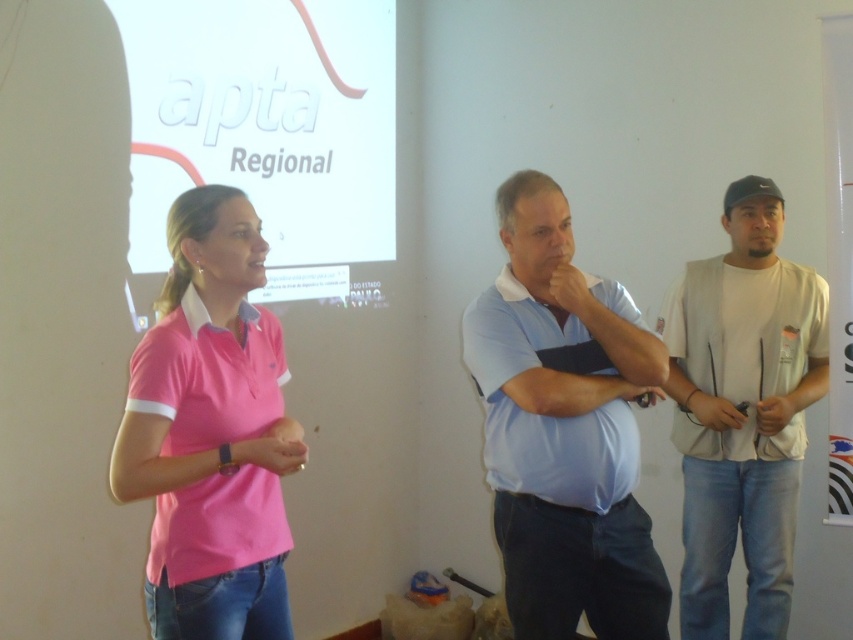
Question: Which of the following is the farthest from the observer?

Choices:
 (A) (578, 392)
 (B) (178, 262)

Answer: (A)

Question: Which point is closer to the camera taking this photo?

Choices:
 (A) (674, 296)
 (B) (787, 540)

Answer: (B)

Question: Does pink cotton shirt at center have a greater width compared to pink fabric arm at center?

Choices:
 (A) no
 (B) yes

Answer: (A)

Question: Can you confirm if pink cotton shirt at center is positioned to the right of white matte vest at right?

Choices:
 (A) yes
 (B) no

Answer: (B)

Question: Does light blue fabric at center have a larger size compared to white matte t-shirt at right?

Choices:
 (A) yes
 (B) no

Answer: (A)

Question: Which object is closer to the camera taking this photo?

Choices:
 (A) light blue fabric at center
 (B) white matte vest at right

Answer: (A)